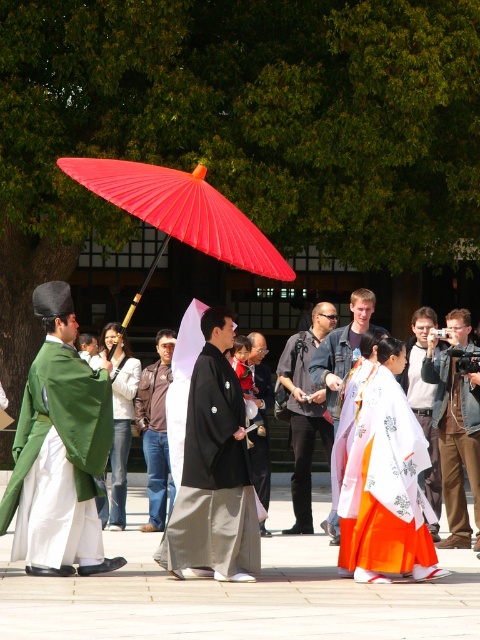
How much distance is there between black matte kimono at center and denim jacket at center?

A distance of 2.36 meters exists between black matte kimono at center and denim jacket at center.

Does black matte kimono at center have a lesser width compared to denim jacket at center?

Incorrect, black matte kimono at center's width is not less than denim jacket at center's.

Find the location of a particular element. black matte kimono at center is located at coordinates (214, 481).

Is matte red umbrella at center thinner than jeans at center?

Incorrect, matte red umbrella at center's width is not less than jeans at center's.

Between point (252, 268) and point (118, 372), which one is positioned in front?

Point (252, 268) is more forward.

Is point (229, 224) positioned in front of point (112, 516)?

That is True.

This screenshot has height=640, width=480. Identify the location of matte red umbrella at center. pyautogui.click(x=180, y=212).

Is dark gray denim jacket at center to the right of silk kimono at center from the viewer's perspective?

Indeed, dark gray denim jacket at center is positioned on the right side of silk kimono at center.

Can you confirm if dark gray denim jacket at center is wider than silk kimono at center?

Yes, dark gray denim jacket at center is wider than silk kimono at center.

I want to click on dark gray denim jacket at center, so click(305, 410).

Where is `dark gray denim jacket at center`? This screenshot has width=480, height=640. dark gray denim jacket at center is located at coordinates (305, 410).